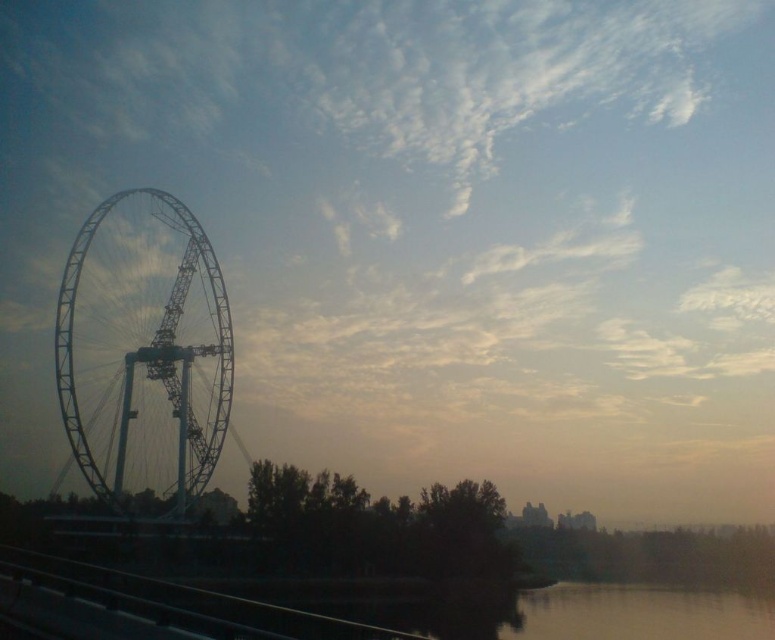
Is point (291, 620) positioned before point (121, 326)?

Yes, point (291, 620) is in front of point (121, 326).

The height and width of the screenshot is (640, 775). Identify the location of white metallic ferris wheel at left. (424, 572).